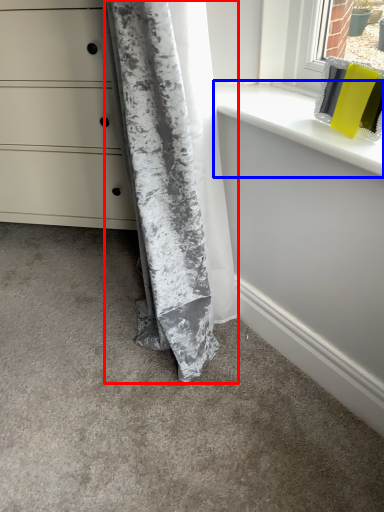
Question: Which of the following is the closest to the observer, curtain (highlighted by a red box) or window sill (highlighted by a blue box)?

Choices:
 (A) curtain
 (B) window sill

Answer: (A)